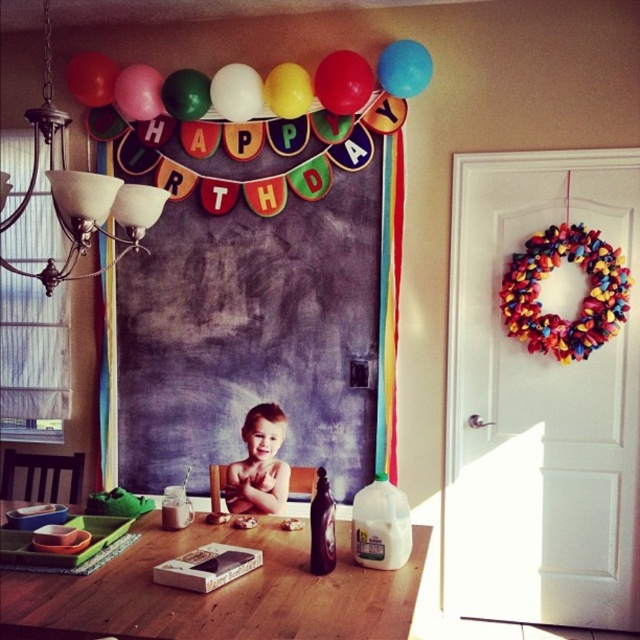
The image size is (640, 640). What do you see at coordinates (259, 465) in the screenshot?
I see `smooth skin baby at center` at bounding box center [259, 465].

Does smooth skin baby at center have a larger size compared to pink matte balloon at upper center?

Yes.

Is point (253, 490) less distant than point (125, 112)?

Yes, it is.

Where is `smooth skin baby at center`? Image resolution: width=640 pixels, height=640 pixels. smooth skin baby at center is located at coordinates (259, 465).

Can you confirm if colorful paper banner at upper center is positioned to the left of green glossy balloon at upper center?

Incorrect, colorful paper banner at upper center is not on the left side of green glossy balloon at upper center.

Can you confirm if colorful paper banner at upper center is wider than green glossy balloon at upper center?

Yes, colorful paper banner at upper center is wider than green glossy balloon at upper center.

Is point (364, 141) in front of point (204, 112)?

Yes, point (364, 141) is in front of point (204, 112).

You are a GUI agent. You are given a task and a screenshot of the screen. Output one action in this format:
    pyautogui.click(x=<x>, y=<y>)
    Task: Click on the colorful paper banner at upper center
    The image size is (640, 640).
    Given the screenshot: What is the action you would take?
    pyautogui.click(x=257, y=310)

Is shiny red balloon at upper center shorter than yellow matte balloon at upper center?

No, shiny red balloon at upper center is not shorter than yellow matte balloon at upper center.

Where is `shiny red balloon at upper center`? The image size is (640, 640). shiny red balloon at upper center is located at coordinates tap(342, 83).